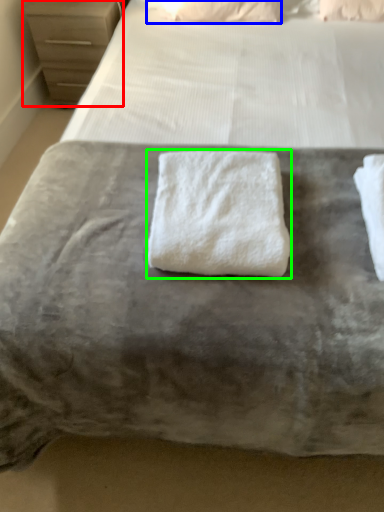
Question: Estimate the real-world distances between objects in this image. Which object is closer to chest of drawers (highlighted by a red box), pillow (highlighted by a blue box) or towel (highlighted by a green box)?

Choices:
 (A) pillow
 (B) towel

Answer: (A)